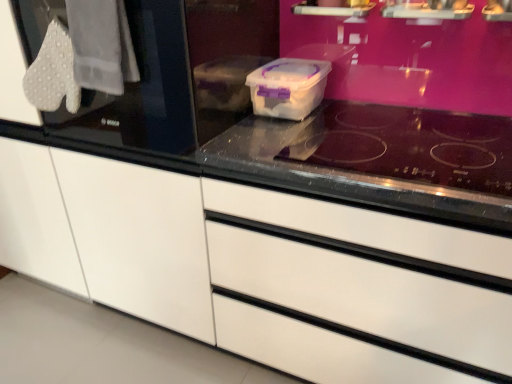
The width and height of the screenshot is (512, 384). I want to click on empty space that is ontop of white glossy drawer at center (from a real-world perspective), so [403, 147].